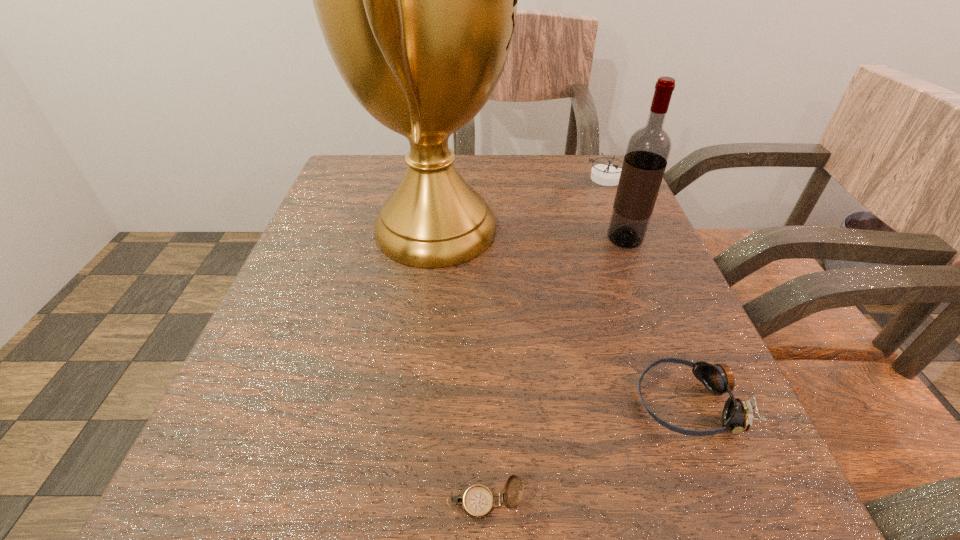
Locate an element on the screen. The height and width of the screenshot is (540, 960). vacant space positioned through the lenses of the second nearest object is located at coordinates (445, 403).

You are a GUI agent. You are given a task and a screenshot of the screen. Output one action in this format:
    pyautogui.click(x=<x>, y=<y>)
    Task: Click on the blank space located through the lenses of the second nearest object
    
    Given the screenshot: What is the action you would take?
    pyautogui.click(x=453, y=403)

Where is `free region located 0.280m on the face of the nearer compass`? free region located 0.280m on the face of the nearer compass is located at coordinates (190, 503).

I want to click on vacant space situated 0.220m on the face of the nearer compass, so click(246, 503).

You are a GUI agent. You are given a task and a screenshot of the screen. Output one action in this format:
    pyautogui.click(x=<x>, y=<y>)
    Task: Click on the vacant region located 0.160m on the face of the nearer compass
    The width and height of the screenshot is (960, 540).
    Given the screenshot: What is the action you would take?
    pyautogui.click(x=300, y=503)

Where is `trophy cup located in the far edge section of the desktop`? trophy cup located in the far edge section of the desktop is located at coordinates (416, 0).

Locate an element on the screen. This screenshot has width=960, height=540. compass that is positioned at the far edge is located at coordinates pos(604,174).

Where is `object at the near edge`? The height and width of the screenshot is (540, 960). object at the near edge is located at coordinates (478, 501).

The image size is (960, 540). I want to click on object that is at the left edge, so click(416, 0).

Where is `wine bottle present at the right edge`? The height and width of the screenshot is (540, 960). wine bottle present at the right edge is located at coordinates (648, 149).